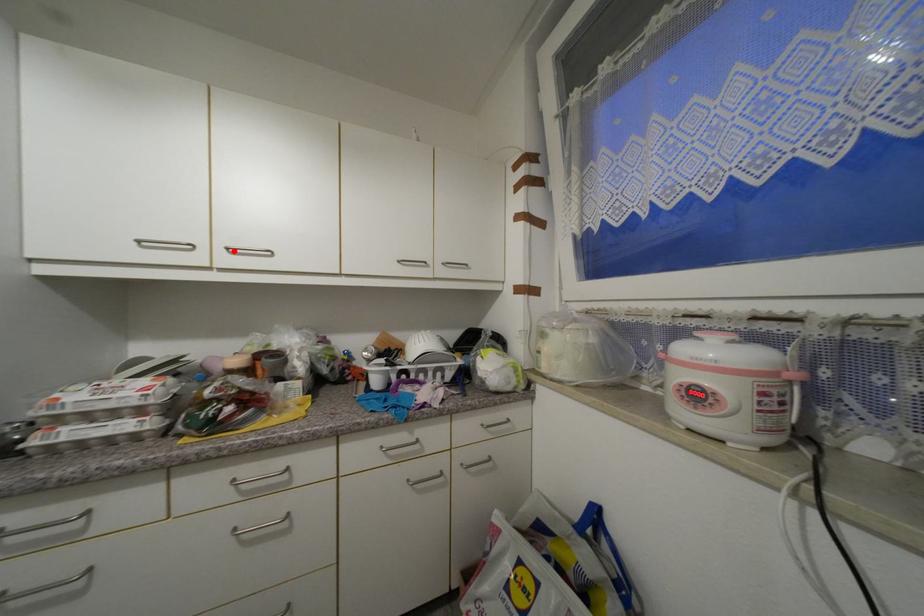
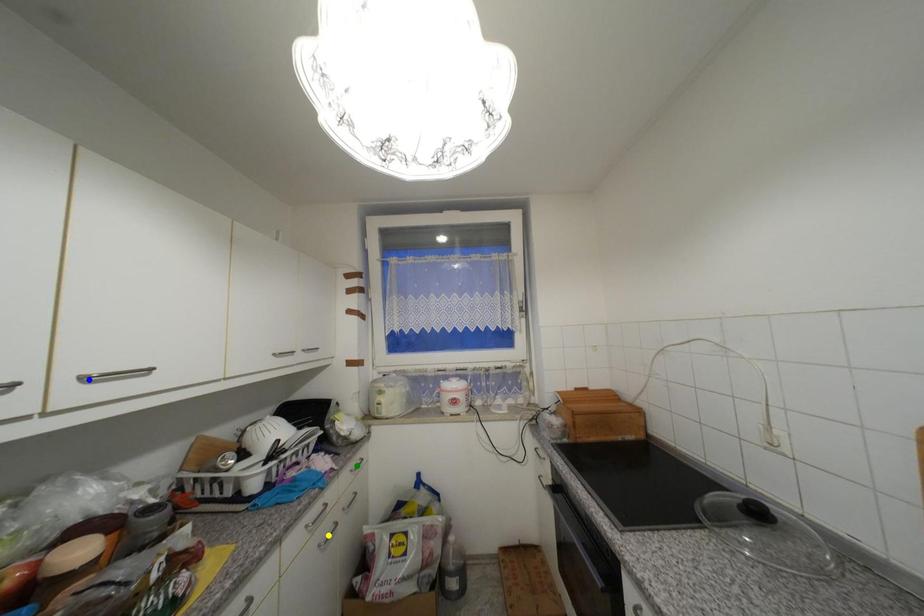
Question: I am providing you with two images of the same scene from different viewpoints. A red point is marked on the first image. You are given multiple points on the second image. In image 2, which mark is for the same physical point as the one in image 1?

Choices:
 (A) green point
 (B) yellow point
 (C) blue point

Answer: (C)